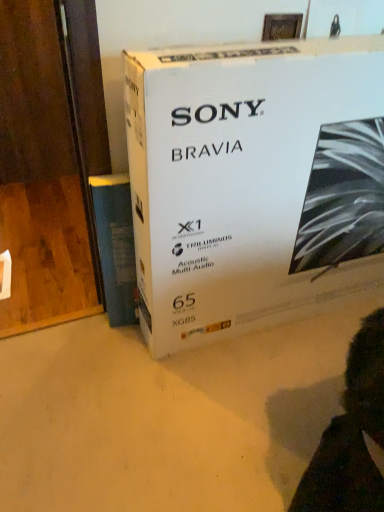
Question: Would you say white cardboard box at center contains blue paper at left?

Choices:
 (A) no
 (B) yes

Answer: (A)

Question: Can you confirm if white cardboard box at center is taller than blue paper at left?

Choices:
 (A) yes
 (B) no

Answer: (A)

Question: Does white cardboard box at center have a smaller size compared to blue paper at left?

Choices:
 (A) no
 (B) yes

Answer: (A)

Question: Does white cardboard box at center appear on the right side of blue paper at left?

Choices:
 (A) no
 (B) yes

Answer: (B)

Question: Is blue paper at left at the back of white cardboard box at center?

Choices:
 (A) yes
 (B) no

Answer: (B)

Question: From a real-world perspective, is white cardboard box at center positioned over blue paper at left based on gravity?

Choices:
 (A) no
 (B) yes

Answer: (B)

Question: From a real-world perspective, is blue paper at left located beneath white cardboard box at center?

Choices:
 (A) no
 (B) yes

Answer: (B)

Question: Is blue paper at left completely or partially outside of white cardboard box at center?

Choices:
 (A) no
 (B) yes

Answer: (B)

Question: From the image's perspective, would you say blue paper at left is positioned over white cardboard box at center?

Choices:
 (A) no
 (B) yes

Answer: (A)

Question: Would you say white cardboard box at center is part of blue paper at left's contents?

Choices:
 (A) no
 (B) yes

Answer: (A)

Question: From the image's perspective, does blue paper at left appear lower than white cardboard box at center?

Choices:
 (A) no
 (B) yes

Answer: (B)

Question: Is blue paper at left aimed at white cardboard box at center?

Choices:
 (A) yes
 (B) no

Answer: (B)

Question: Based on their positions, is blue paper at left located to the left or right of white cardboard box at center?

Choices:
 (A) left
 (B) right

Answer: (A)